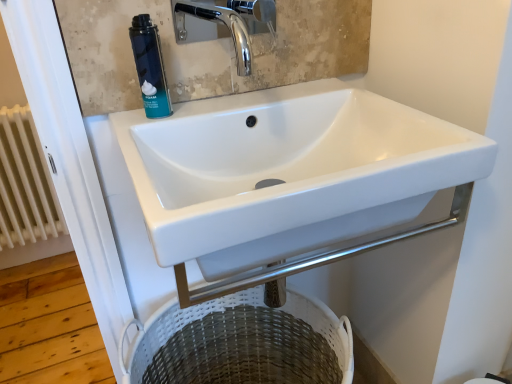
Question: Considering their positions, is white glossy sink at center located in front of or behind white woven laundry basket at lower center?

Choices:
 (A) behind
 (B) front

Answer: (B)

Question: Is white glossy sink at center bigger or smaller than white woven laundry basket at lower center?

Choices:
 (A) small
 (B) big

Answer: (A)

Question: Based on their relative distances, which object is farther from the blue matte foam canister at upper left?

Choices:
 (A) white painted metal radiator at left
 (B) chrome metallic faucet at upper center
 (C) white glossy sink at center
 (D) white woven laundry basket at lower center

Answer: (A)

Question: Which is farther from the white glossy sink at center?

Choices:
 (A) blue matte foam canister at upper left
 (B) white woven laundry basket at lower center
 (C) white painted metal radiator at left
 (D) chrome metallic faucet at upper center

Answer: (C)